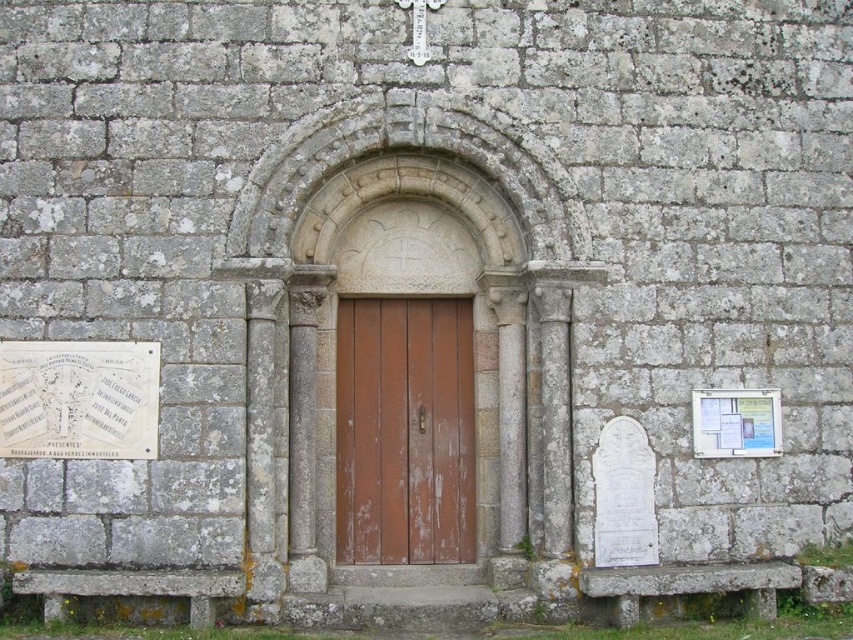
Is point (10, 376) farther from viewer compared to point (762, 426)?

No, it is in front of (762, 426).

Is white paper plaque at lower left taller than white paper at center?

Indeed, white paper plaque at lower left has a greater height compared to white paper at center.

Where is `white paper plaque at lower left`? The width and height of the screenshot is (853, 640). white paper plaque at lower left is located at coordinates (78, 400).

At what (x,y) coordinates should I click in order to perform the action: click on white paper plaque at lower left. Please return your answer as a coordinate pair (x, y). Looking at the image, I should click on (78, 400).

Is rusty wood door at center to the left of white paper plaque at lower left from the viewer's perspective?

In fact, rusty wood door at center is to the right of white paper plaque at lower left.

Does point (451, 534) come in front of point (117, 442)?

No, it is behind (117, 442).

The image size is (853, 640). What do you see at coordinates (404, 429) in the screenshot?
I see `rusty wood door at center` at bounding box center [404, 429].

You are a GUI agent. You are given a task and a screenshot of the screen. Output one action in this format:
    pyautogui.click(x=<x>, y=<y>)
    Task: Click on the rusty wood door at center
    The width and height of the screenshot is (853, 640).
    Given the screenshot: What is the action you would take?
    pyautogui.click(x=404, y=429)

Consider the image. Does rusty wood door at center appear on the left side of white paper at center?

Indeed, rusty wood door at center is positioned on the left side of white paper at center.

Looking at this image, does rusty wood door at center have a greater height compared to white paper at center?

Yes.

This screenshot has width=853, height=640. What do you see at coordinates (404, 429) in the screenshot? I see `rusty wood door at center` at bounding box center [404, 429].

The image size is (853, 640). I want to click on rusty wood door at center, so click(404, 429).